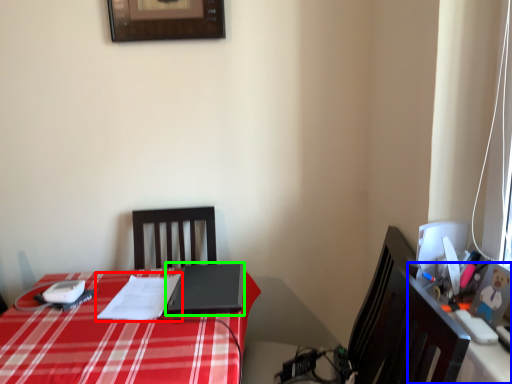
Question: Based on their relative distances, which object is nearer to notepad (highlighted by a red box)? Choose from computer desk (highlighted by a blue box) and laptop (highlighted by a green box).

Choices:
 (A) computer desk
 (B) laptop

Answer: (B)